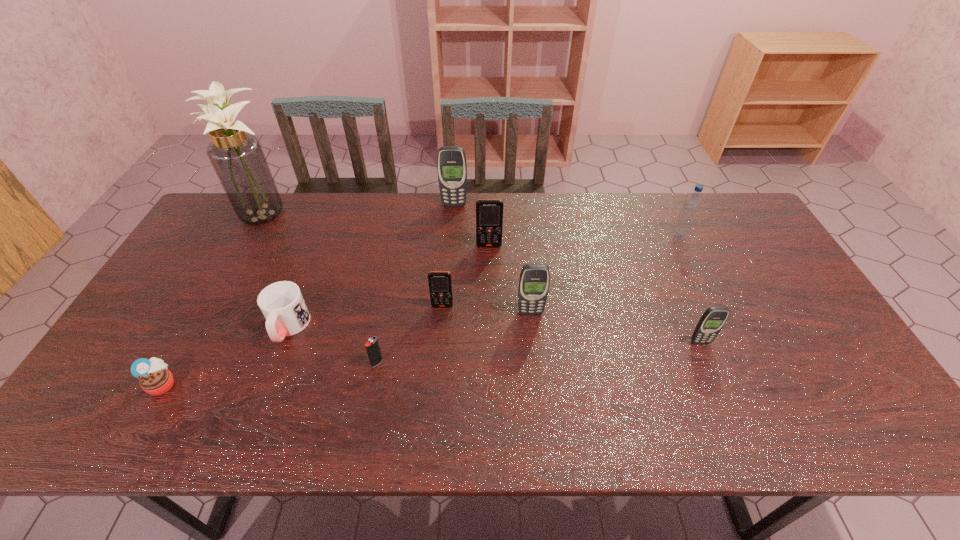
The width and height of the screenshot is (960, 540). Identify the location of cellular telephone situated at the far edge. (451, 163).

Identify the location of water bottle at the far edge. (691, 206).

Image resolution: width=960 pixels, height=540 pixels. What are the coordinates of `flower arrangement that is at the left edge` in the screenshot? It's located at (237, 157).

In order to click on muffin positioned at the left edge in this screenshot , I will do `click(155, 379)`.

The width and height of the screenshot is (960, 540). Identify the location of object that is at the far left corner. (237, 157).

Find the location of a particular element. This screenshot has width=960, height=540. vacant space at the far edge of the desktop is located at coordinates [697, 219].

Identify the location of free region at the near edge. (x=534, y=437).

The image size is (960, 540). What are the coordinates of `free space at the left edge` in the screenshot? It's located at (171, 355).

In the image, there is a desktop. Identify the location of free space at the right edge. The image size is (960, 540). (757, 273).

Locate an element on the screen. free space at the near left corner is located at coordinates (126, 427).